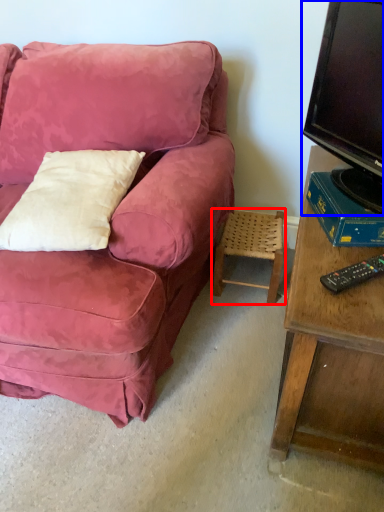
Question: Which object is closer to the camera taking this photo, stool (highlighted by a red box) or television (highlighted by a blue box)?

Choices:
 (A) stool
 (B) television

Answer: (B)